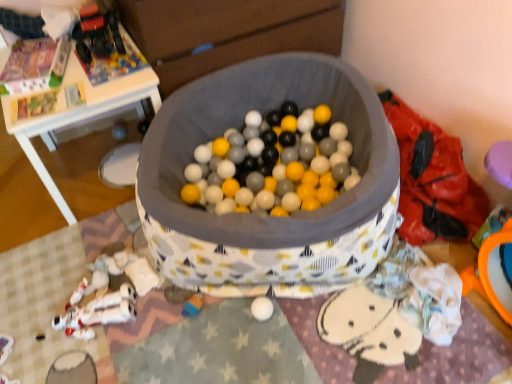
Identify the location of free space to the left of rubberized plastic toy at lower center, the fourth toy viewed from the top. This screenshot has height=384, width=512. (149, 319).